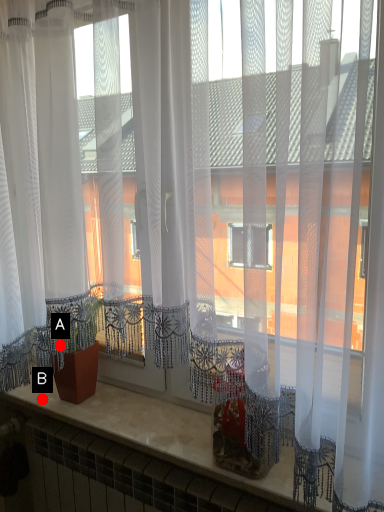
Question: Two points are circled on the image, labeled by A and B beside each circle. Which point is farther from the camera taking this photo?

Choices:
 (A) A is further
 (B) B is further

Answer: (B)